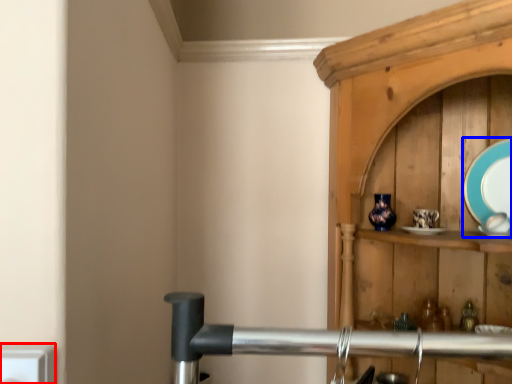
Question: Among these objects, which one is nearest to the camera, electric outlet (highlighted by a red box) or platter (highlighted by a blue box)?

Choices:
 (A) electric outlet
 (B) platter

Answer: (A)